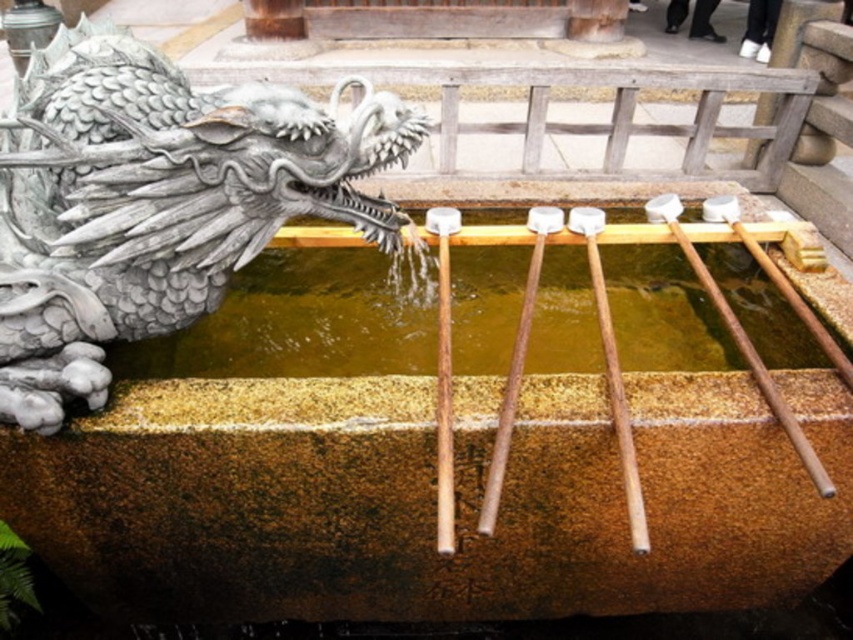
Question: Is gray stone dragon head at left smaller than yellowish stone water at center?

Choices:
 (A) yes
 (B) no

Answer: (B)

Question: Which of the following is the closest to the observer?

Choices:
 (A) pyautogui.click(x=421, y=141)
 (B) pyautogui.click(x=193, y=342)

Answer: (A)

Question: Which of the following is the farthest from the observer?

Choices:
 (A) (229, 369)
 (B) (20, 93)

Answer: (A)

Question: Does gray stone dragon head at left have a larger size compared to yellowish stone water at center?

Choices:
 (A) yes
 (B) no

Answer: (A)

Question: Which point is closer to the camera taking this photo?

Choices:
 (A) (80, 28)
 (B) (260, 292)

Answer: (A)

Question: From the image, what is the correct spatial relationship of gray stone dragon head at left in relation to yellowish stone water at center?

Choices:
 (A) above
 (B) below

Answer: (A)